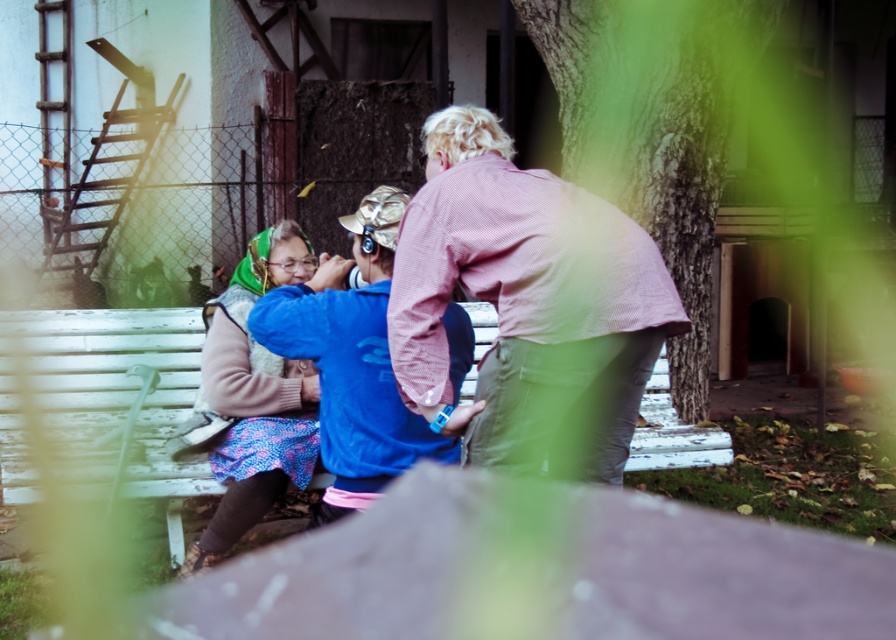
Does blue fleece jacket at center lie in front of matte green scarf at left?

Yes, it is.

I want to click on blue fleece jacket at center, so click(x=352, y=362).

This screenshot has width=896, height=640. In order to click on blue fleece jacket at center in this screenshot , I will do `click(352, 362)`.

Is pink checkered shirt at center bigger than blue fleece jacket at center?

Incorrect, pink checkered shirt at center is not larger than blue fleece jacket at center.

Image resolution: width=896 pixels, height=640 pixels. I want to click on pink checkered shirt at center, so click(528, 305).

Is point (597, 465) farther from viewer compared to point (359, 390)?

No, (597, 465) is closer to viewer.

At what (x,y) coordinates should I click in order to perform the action: click on pink checkered shirt at center. Please return your answer as a coordinate pair (x, y). Looking at the image, I should click on [x=528, y=305].

Between blue cotton jacket at center and matte green scarf at left, which one appears on the left side from the viewer's perspective?

matte green scarf at left is more to the left.

How distant is blue cotton jacket at center from matte green scarf at left?

blue cotton jacket at center and matte green scarf at left are 37.66 inches apart.

Image resolution: width=896 pixels, height=640 pixels. What do you see at coordinates (518, 291) in the screenshot? I see `blue cotton jacket at center` at bounding box center [518, 291].

Locate an element on the screen. blue cotton jacket at center is located at coordinates (518, 291).